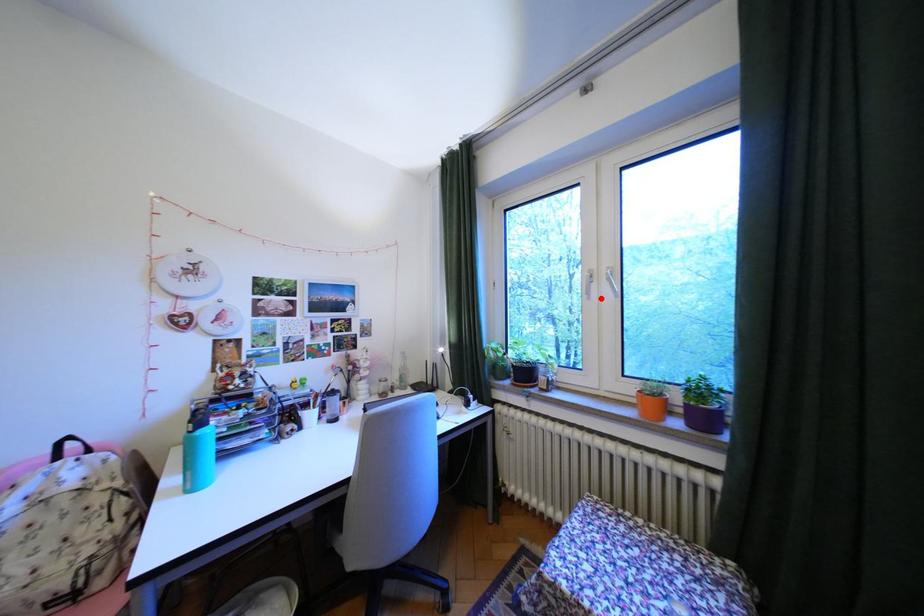
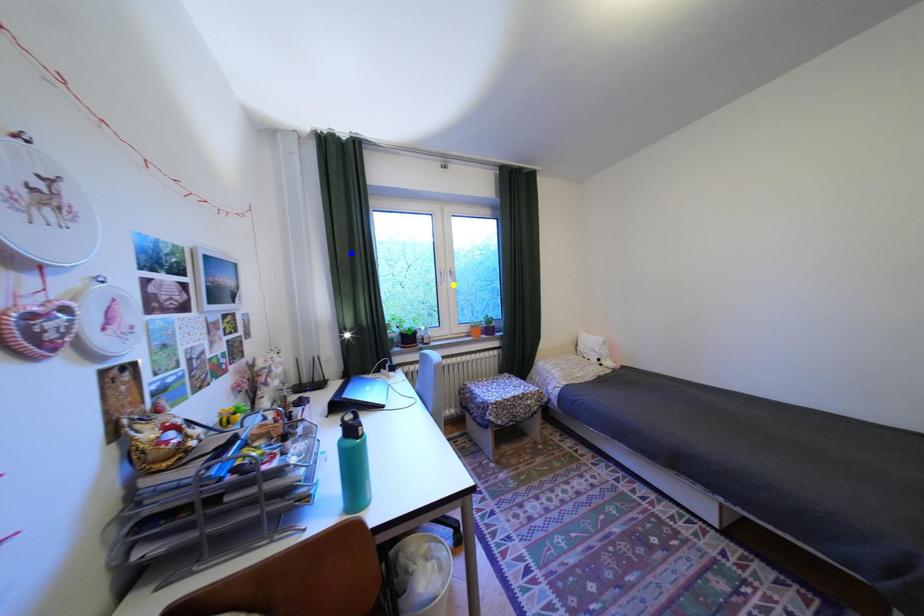
Question: I am providing you with two images of the same scene from different viewpoints. A red point is marked on the first image. You are given multiple points on the second image. Which point in image 2 represents the same 3d spot as the red point in image 1?

Choices:
 (A) green point
 (B) yellow point
 (C) blue point

Answer: (B)